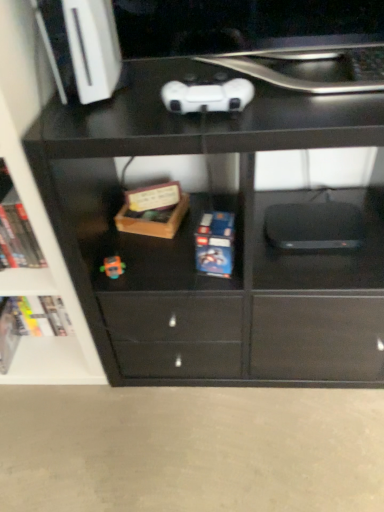
What are the coordinates of `vacant area that is situated to the right of white matte game controller at upper center` in the screenshot? It's located at (307, 96).